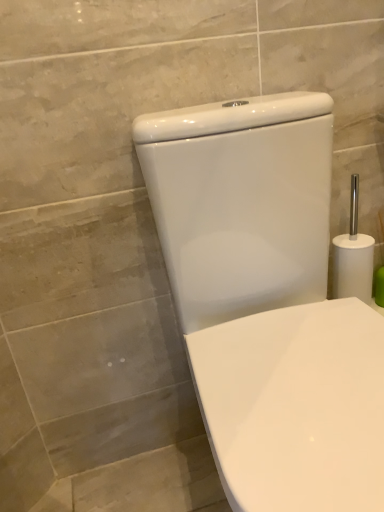
What do you see at coordinates (267, 301) in the screenshot?
I see `white glossy toilet at center` at bounding box center [267, 301].

Locate an element on the screen. white glossy toilet at center is located at coordinates (267, 301).

The image size is (384, 512). I want to click on white glossy toilet at center, so click(267, 301).